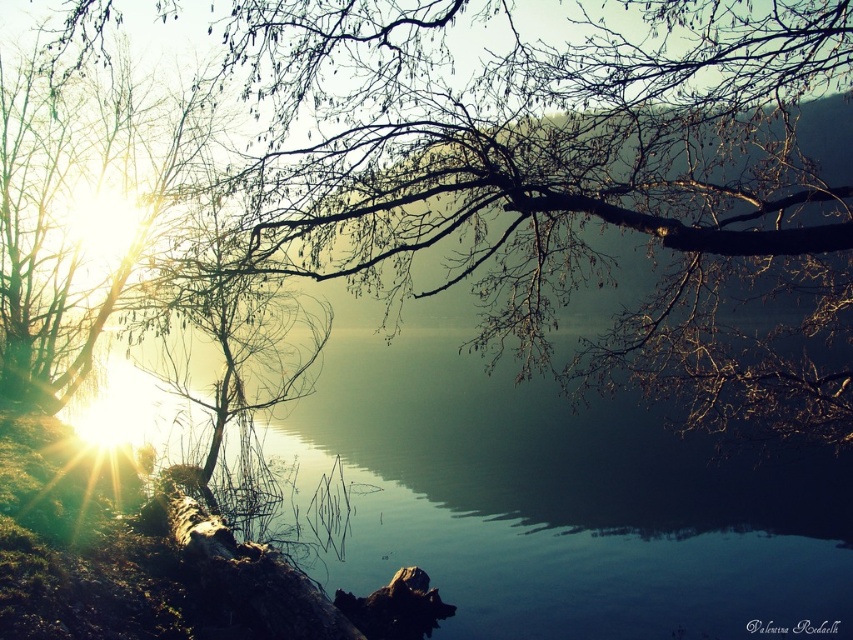
Question: Which point is farther from the camera taking this photo?

Choices:
 (A) (550, 513)
 (B) (451, 268)

Answer: (A)

Question: Which object is closer to the camera taking this photo?

Choices:
 (A) brown textured branches at upper center
 (B) transparent water at center

Answer: (B)

Question: Observing the image, what is the correct spatial positioning of brown textured branches at upper center in reference to transparent water at center?

Choices:
 (A) above
 (B) below

Answer: (A)

Question: Which object is farther from the camera taking this photo?

Choices:
 (A) transparent water at center
 (B) brown textured branches at upper center

Answer: (B)

Question: Is brown textured branches at upper center to the left of transparent water at center from the viewer's perspective?

Choices:
 (A) no
 (B) yes

Answer: (A)

Question: Can you confirm if brown textured branches at upper center is positioned above transparent water at center?

Choices:
 (A) yes
 (B) no

Answer: (A)